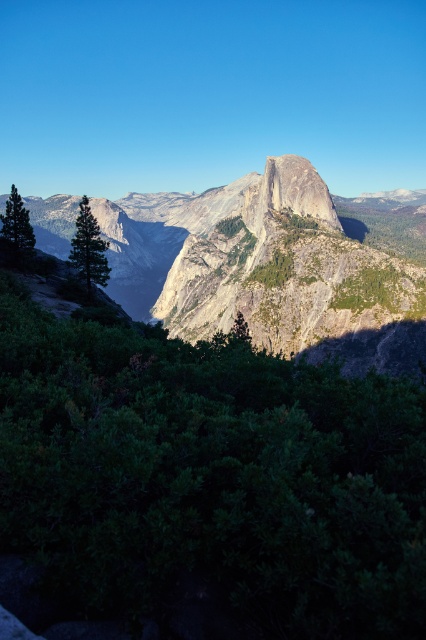
Question: Considering the real-world distances, which object is closest to the green leafy shrub at center?

Choices:
 (A) green matte tree at left
 (B) granite cliff at center
 (C) green leafy tree at left

Answer: (C)

Question: Which point is closer to the camera taking this photo?

Choices:
 (A) (247, 326)
 (B) (17, 246)

Answer: (B)

Question: Does green leafy tree at left have a smaller size compared to green matte tree at left?

Choices:
 (A) yes
 (B) no

Answer: (B)

Question: Does granite cliff at center have a lesser width compared to green leafy tree at left?

Choices:
 (A) yes
 (B) no

Answer: (B)

Question: Where is green leafy tree at left located in relation to green matte tree at left in the image?

Choices:
 (A) below
 (B) above

Answer: (B)

Question: Which of the following is the farthest from the observer?

Choices:
 (A) (x=342, y=198)
 (B) (x=276, y=180)
 (C) (x=20, y=220)

Answer: (A)